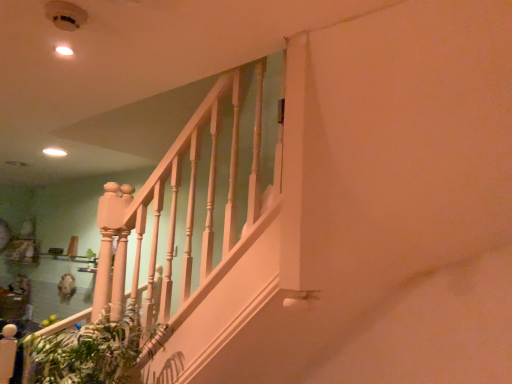
Question: Should I look upward or downward to see green leafy plant at lower left?

Choices:
 (A) up
 (B) down

Answer: (B)